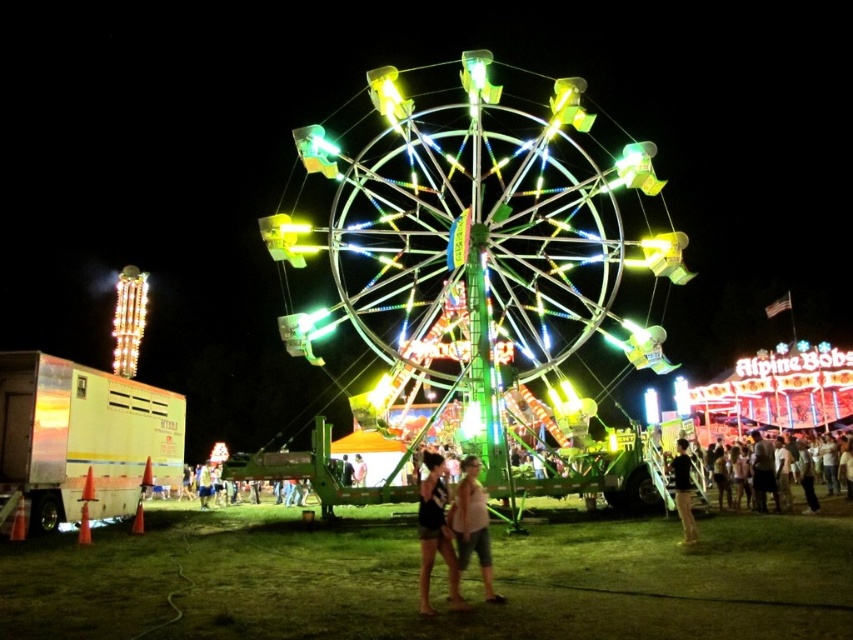
Between point (421, 593) and point (53, 531), which one is positioned behind?

The point (53, 531) is more distant.

What do you see at coordinates (434, 532) in the screenshot?
I see `light brown fabric shorts at center` at bounding box center [434, 532].

Which is behind, point (457, 579) or point (41, 504)?

The point (41, 504) is behind.

You are a GUI agent. You are given a task and a screenshot of the screen. Output one action in this format:
    pyautogui.click(x=<x>, y=<y>)
    Task: Click on the light brown fabric shorts at center
    The width and height of the screenshot is (853, 640).
    Given the screenshot: What is the action you would take?
    pyautogui.click(x=434, y=532)

Does matte pink shirt at center lie behind green metallic ferris wheel at center?

No, matte pink shirt at center is closer to the viewer.

Where is `matte pink shirt at center`? This screenshot has height=640, width=853. matte pink shirt at center is located at coordinates (473, 525).

Does point (465, 472) lie in front of point (633, 480)?

Yes, point (465, 472) is in front of point (633, 480).

The image size is (853, 640). What are the coordinates of `matte pink shirt at center` in the screenshot? It's located at (473, 525).

Could you measure the distance between multicolored metallic ferris wheel at center and light brown fabric shorts at center?

40.58 meters

Which is in front, point (372, 276) or point (450, 577)?

Point (450, 577) is more forward.

Where is `multicolored metallic ferris wheel at center`? The image size is (853, 640). multicolored metallic ferris wheel at center is located at coordinates (473, 234).